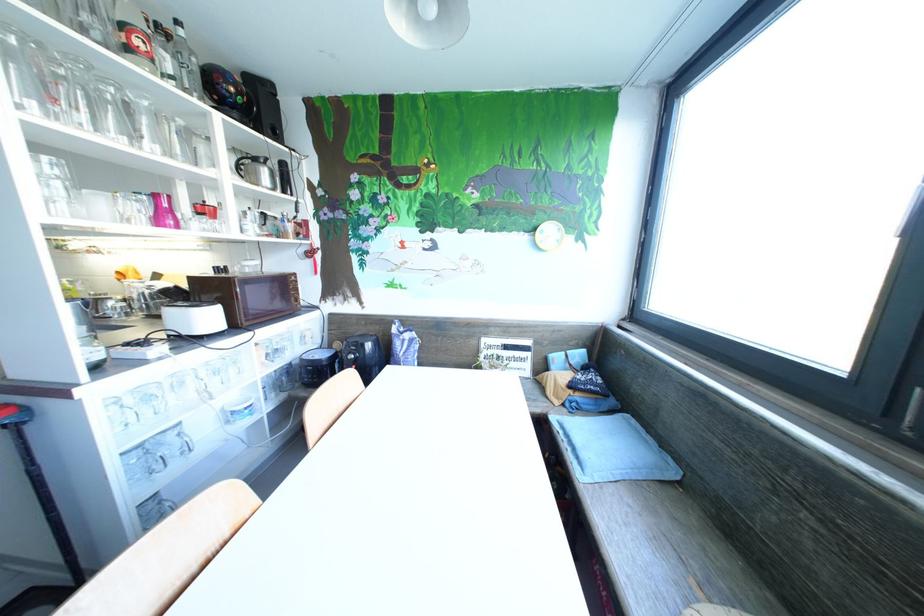
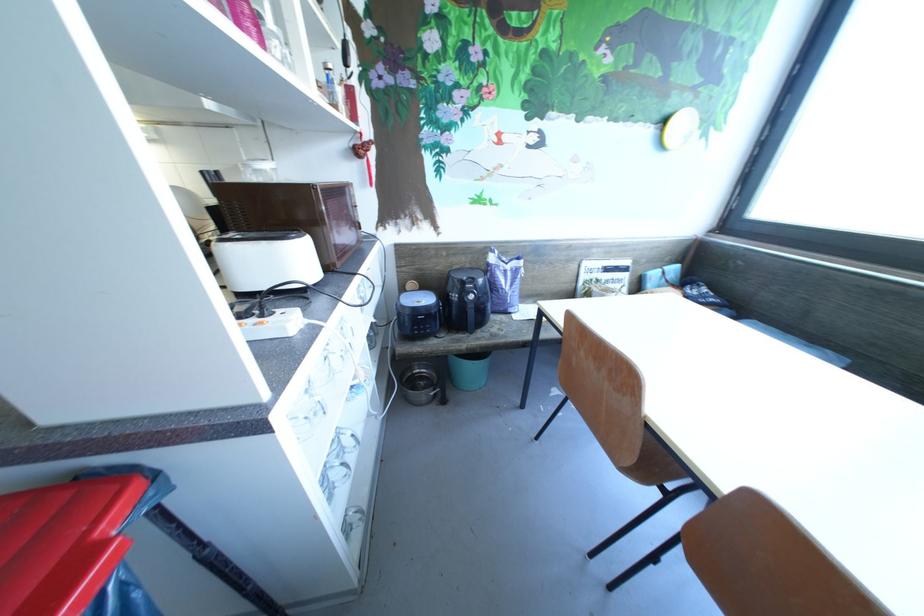
Question: I am providing you with two images of the same scene from different viewpoints. Please identify which objects are invisible in image2.

Choices:
 (A) purple food bag
 (B) glass mug handle
 (C) red fabric bag
 (D) chair sitting surface

Answer: (D)